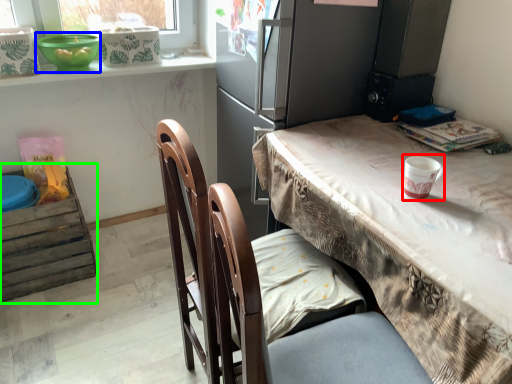
Question: Which object is the closest to the paper cup (highlighted by a red box)? Choose among these: bowl (highlighted by a blue box) or leftover (highlighted by a green box).

Choices:
 (A) bowl
 (B) leftover

Answer: (A)